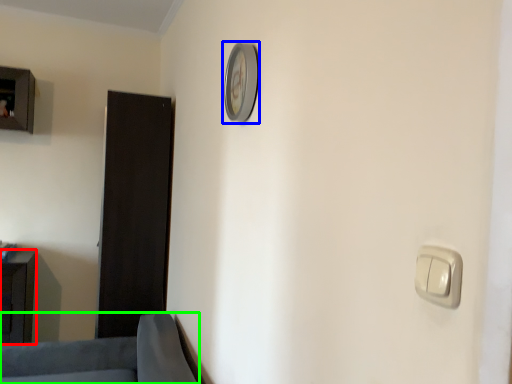
Question: Based on their relative distances, which object is nearer to furniture (highlighted by a red box)? Choose from clock (highlighted by a blue box) and furniture (highlighted by a green box).

Choices:
 (A) clock
 (B) furniture

Answer: (B)